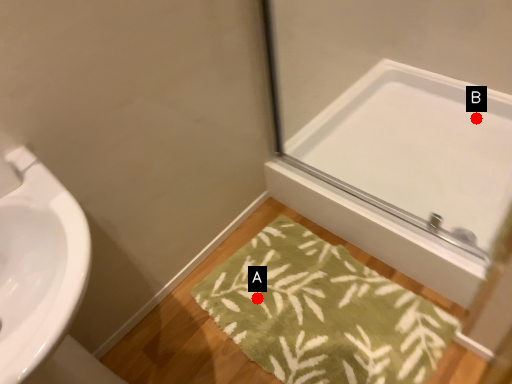
Question: Two points are circled on the image, labeled by A and B beside each circle. Which point is farther to the camera?

Choices:
 (A) A is further
 (B) B is further

Answer: (B)